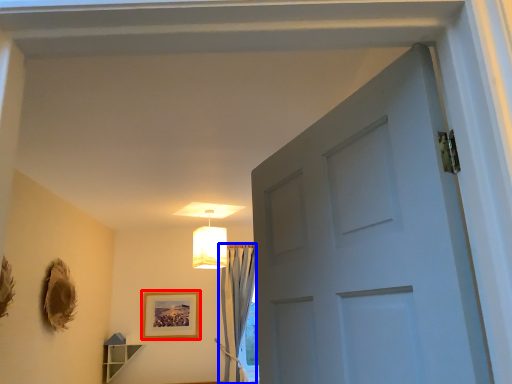
Question: Which of the following is the farthest to the observer, picture frame (highlighted by a red box) or curtain (highlighted by a blue box)?

Choices:
 (A) picture frame
 (B) curtain

Answer: (A)